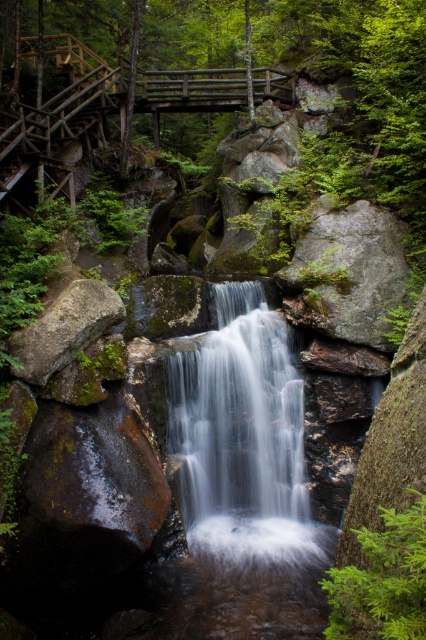
What do you see at coordinates (241, 436) in the screenshot? The height and width of the screenshot is (640, 426). I see `smooth gray water at center` at bounding box center [241, 436].

Does smooth gray water at center appear under brown rough rock at lower left?

Correct, smooth gray water at center is located below brown rough rock at lower left.

Between point (278, 371) and point (114, 305), which one is positioned behind?

The point (278, 371) is behind.

At what (x,y) coordinates should I click in order to perform the action: click on smooth gray water at center. Please return your answer as a coordinate pair (x, y). This screenshot has width=426, height=640. Looking at the image, I should click on (241, 436).